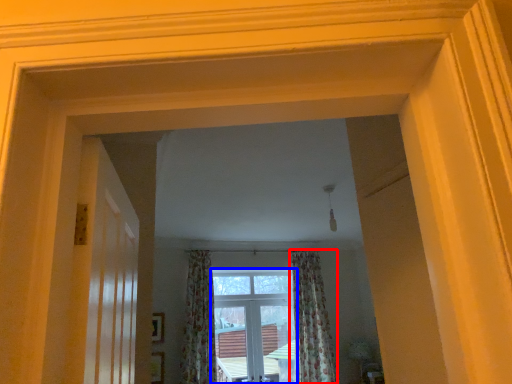
Question: Which object is closer to the camera taking this photo, curtain (highlighted by a red box) or window (highlighted by a blue box)?

Choices:
 (A) curtain
 (B) window

Answer: (A)